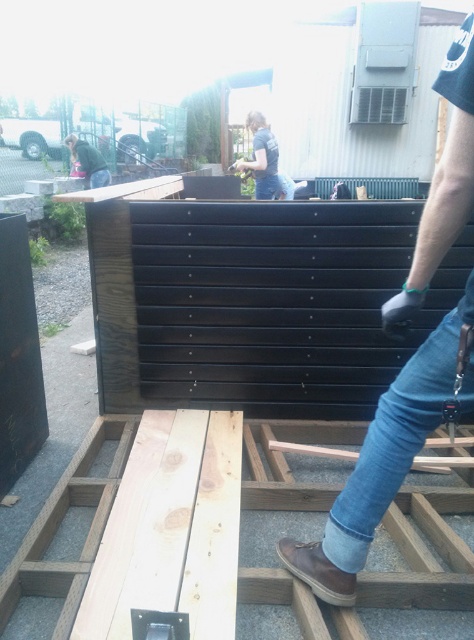
Question: Which of these objects is positioned farthest from the green fabric jacket at upper left?

Choices:
 (A) jeans at center
 (B) denim jeans at upper center

Answer: (A)

Question: Which of the following is the farthest from the observer?

Choices:
 (A) (255, 129)
 (B) (470, 22)

Answer: (A)

Question: Is jeans at center behind denim jeans at upper center?

Choices:
 (A) yes
 (B) no

Answer: (B)

Question: Which object is closer to the camera taking this photo?

Choices:
 (A) denim jeans at upper center
 (B) green fabric jacket at upper left
 (C) jeans at center

Answer: (C)

Question: Does denim jeans at upper center lie in front of green fabric jacket at upper left?

Choices:
 (A) no
 (B) yes

Answer: (B)

Question: Is the position of jeans at center more distant than that of denim jeans at upper center?

Choices:
 (A) no
 (B) yes

Answer: (A)